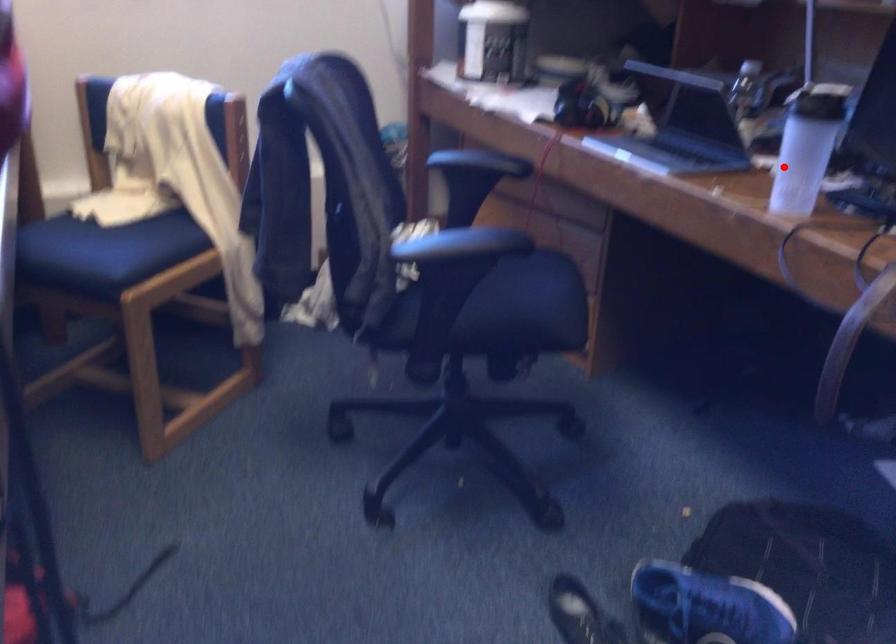
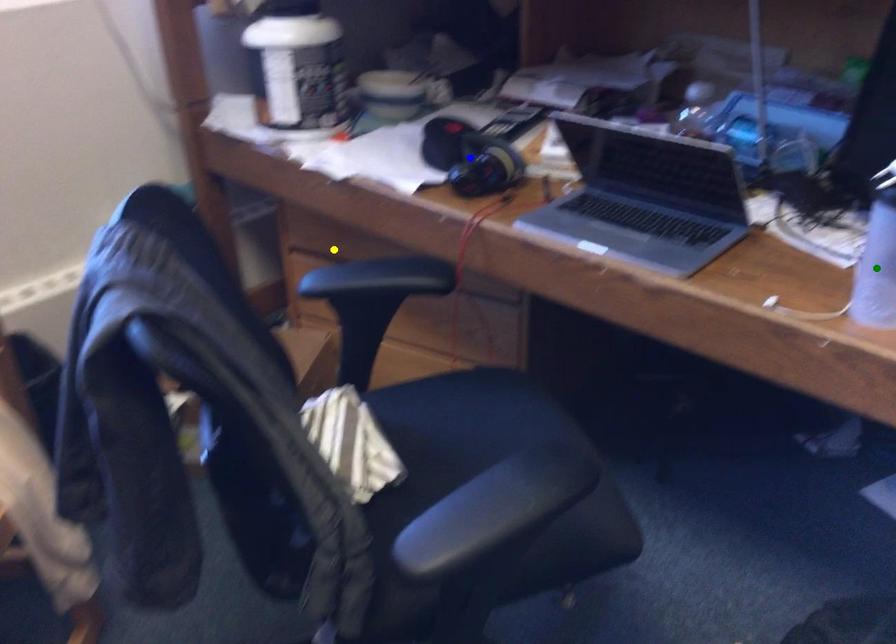
Question: I am providing you with two images of the same scene from different viewpoints. A red point is marked on the first image. You are given multiple points on the second image. In image 2, which mark is for the same physical point as the one in image 1?

Choices:
 (A) green point
 (B) yellow point
 (C) blue point

Answer: (A)